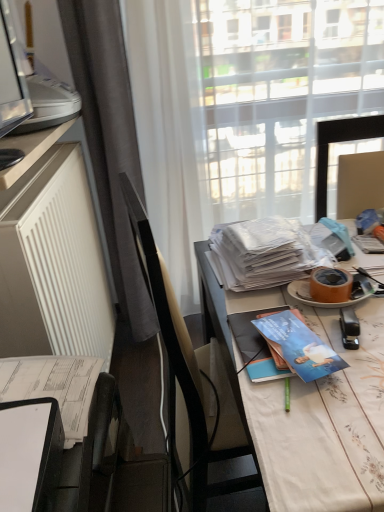
Where is `vacant space behind blue glossy book at center`? The image size is (384, 512). vacant space behind blue glossy book at center is located at coordinates (262, 303).